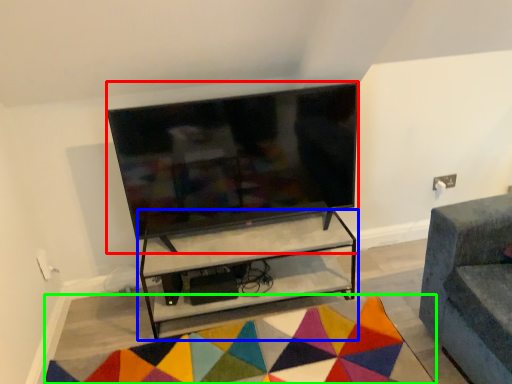
Question: Considering the real-world distances, which object is farthest from television (highlighted by a red box)? shelf (highlighted by a blue box) or mat (highlighted by a green box)?

Choices:
 (A) shelf
 (B) mat

Answer: (B)